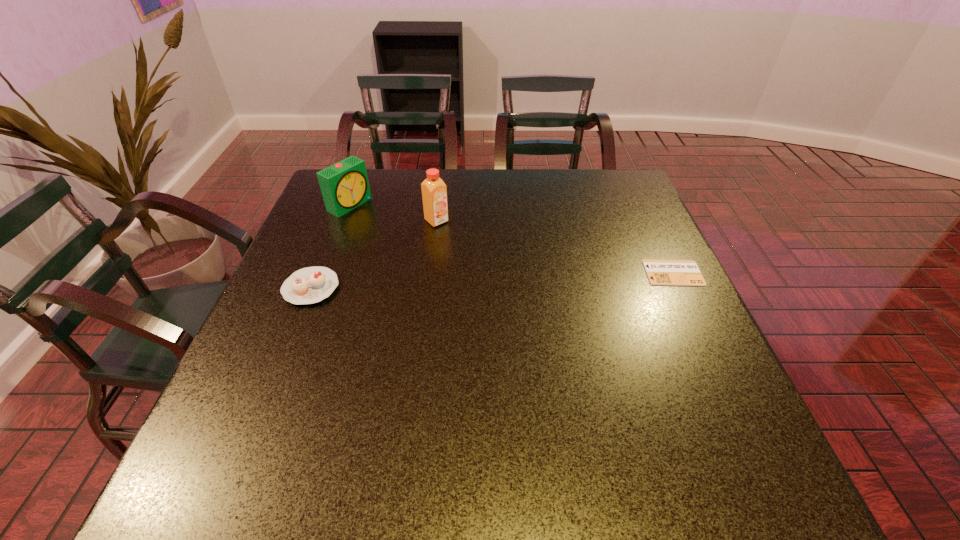
Locate an element on the screen. This screenshot has width=960, height=540. free spot on the desktop that is between the cupcake and the rightmost object and is positioned on the front and back of the tallest object is located at coordinates (513, 280).

Identify the location of vacant spot on the desktop that is between the cupcake and the identity card and is positioned on the front-facing side of the alarm clock. (493, 280).